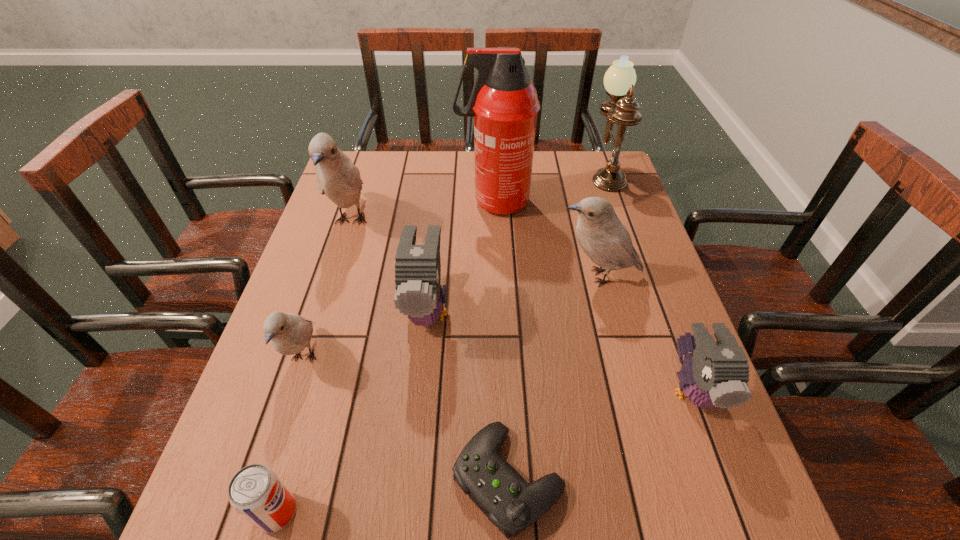
Where is `vacant area located at the beak of the third bird from right to left`? vacant area located at the beak of the third bird from right to left is located at coordinates (410, 472).

Find the location of `vacant area located 0.170m at the beak of the nearest white bird`. vacant area located 0.170m at the beak of the nearest white bird is located at coordinates (264, 480).

I want to click on vacant space situated at the beak of the right gray bird, so click(744, 534).

Identify the location of free space located 0.320m on the right of the soda. The height and width of the screenshot is (540, 960). (490, 512).

Locate an element on the screen. The height and width of the screenshot is (540, 960). fire extinguisher that is positioned at the far edge is located at coordinates (504, 103).

I want to click on oil lamp that is at the far edge, so (x=619, y=80).

The height and width of the screenshot is (540, 960). Find the location of `object at the near edge`. object at the near edge is located at coordinates (256, 492).

I want to click on soda positioned at the left edge, so click(x=256, y=492).

Locate an element on the screen. oil lamp positioned at the right edge is located at coordinates (619, 80).

Where is `object that is at the near left corner`? The width and height of the screenshot is (960, 540). object that is at the near left corner is located at coordinates (256, 492).